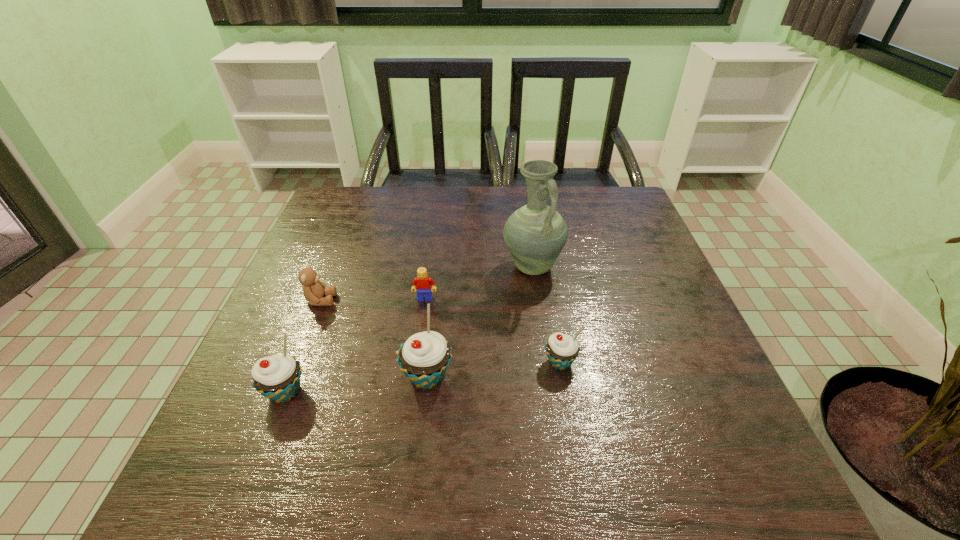
Where is `free location that satisfies the following two spatial constraints: 1. on the face of the Lego; 2. on the face of the teddy bear`? Image resolution: width=960 pixels, height=540 pixels. free location that satisfies the following two spatial constraints: 1. on the face of the Lego; 2. on the face of the teddy bear is located at coordinates [x=424, y=300].

Identify the location of vacant space that satisfies the following two spatial constraints: 1. on the face of the fourth shortest object; 2. on the right side of the teddy bear. (285, 392).

I want to click on blank area in the image that satisfies the following two spatial constraints: 1. on the face of the Lego; 2. on the face of the teddy bear, so click(424, 300).